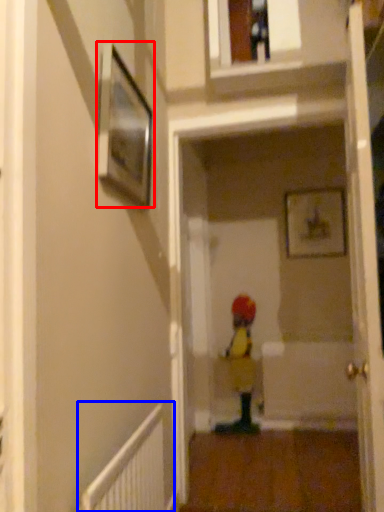
Question: Among these objects, which one is farthest to the camera, picture frame (highlighted by a red box) or radiator (highlighted by a blue box)?

Choices:
 (A) picture frame
 (B) radiator

Answer: (A)